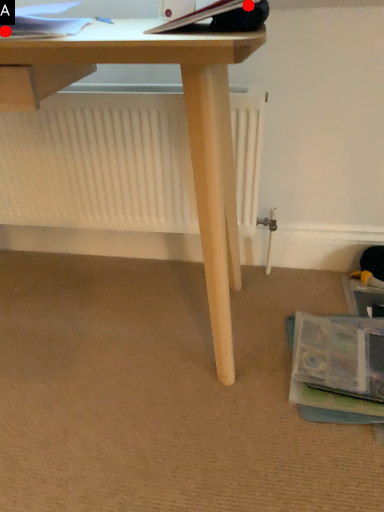
Question: Two points are circled on the image, labeled by A and B beside each circle. Among these points, which one is nearest to the camera?

Choices:
 (A) A is closer
 (B) B is closer

Answer: (B)